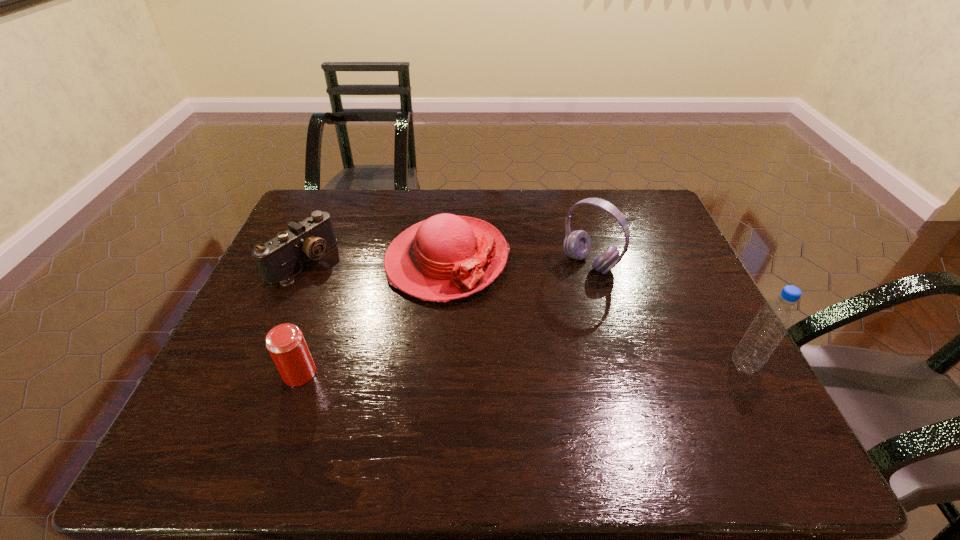
Where is `blank space located on the front-facing side of the camera`? blank space located on the front-facing side of the camera is located at coordinates (396, 323).

You are a GUI agent. You are given a task and a screenshot of the screen. Output one action in this format:
    pyautogui.click(x=<x>, y=<y>)
    Task: Click on the vacant space situated 0.380m on the headband and ear cups of the fourth object from left to right
    
    Given the screenshot: What is the action you would take?
    pyautogui.click(x=482, y=359)

Identify the location of vacant space located on the headband and ear cups of the fourth object from left to right. The height and width of the screenshot is (540, 960). (502, 341).

Identify the location of free region located 0.350m on the headband and ear cups of the fourth object from left to right. (491, 352).

The width and height of the screenshot is (960, 540). Find the location of `free space located at the front of the third object from right to left with a bow`. free space located at the front of the third object from right to left with a bow is located at coordinates (515, 399).

The width and height of the screenshot is (960, 540). I want to click on vacant area located 0.280m at the front of the third object from right to left with a bow, so click(511, 392).

At what (x,y) coordinates should I click in order to perform the action: click on free space located at the front of the third object from right to left with a bow. Please return your answer as a coordinate pair (x, y). The image size is (960, 540). Looking at the image, I should click on (516, 403).

Find the location of a particular element. The image size is (960, 540). object situated at the far edge is located at coordinates (445, 257).

Identify the location of object that is at the near edge. The height and width of the screenshot is (540, 960). (285, 342).

What are the coordinates of `beer can present at the left edge` in the screenshot? It's located at (285, 342).